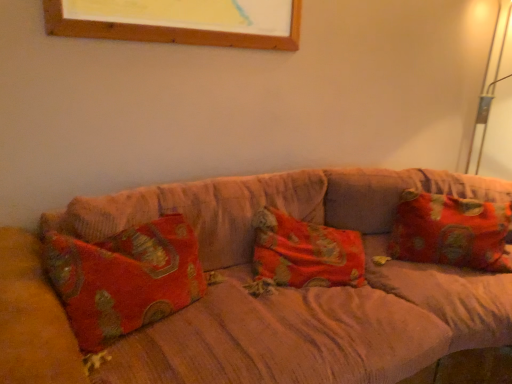
Question: Is floral fabric pillow at right inside the boundaries of velvet-like beige couch at center, or outside?

Choices:
 (A) inside
 (B) outside

Answer: (A)

Question: Relative to velvet-like beige couch at center, is floral fabric pillow at right in front or behind?

Choices:
 (A) behind
 (B) front

Answer: (A)

Question: In terms of width, does floral fabric pillow at right look wider or thinner when compared to velvet-like beige couch at center?

Choices:
 (A) thin
 (B) wide

Answer: (A)

Question: Considering the positions of velvet-like beige couch at center and floral fabric pillow at right in the image, is velvet-like beige couch at center taller or shorter than floral fabric pillow at right?

Choices:
 (A) tall
 (B) short

Answer: (A)

Question: In terms of width, does velvet-like beige couch at center look wider or thinner when compared to floral fabric pillow at right?

Choices:
 (A) thin
 (B) wide

Answer: (B)

Question: Based on their positions, is velvet-like beige couch at center located to the left or right of floral fabric pillow at right?

Choices:
 (A) right
 (B) left

Answer: (B)

Question: Is point (334, 190) closer or farther from the camera than point (464, 203)?

Choices:
 (A) closer
 (B) farther

Answer: (B)